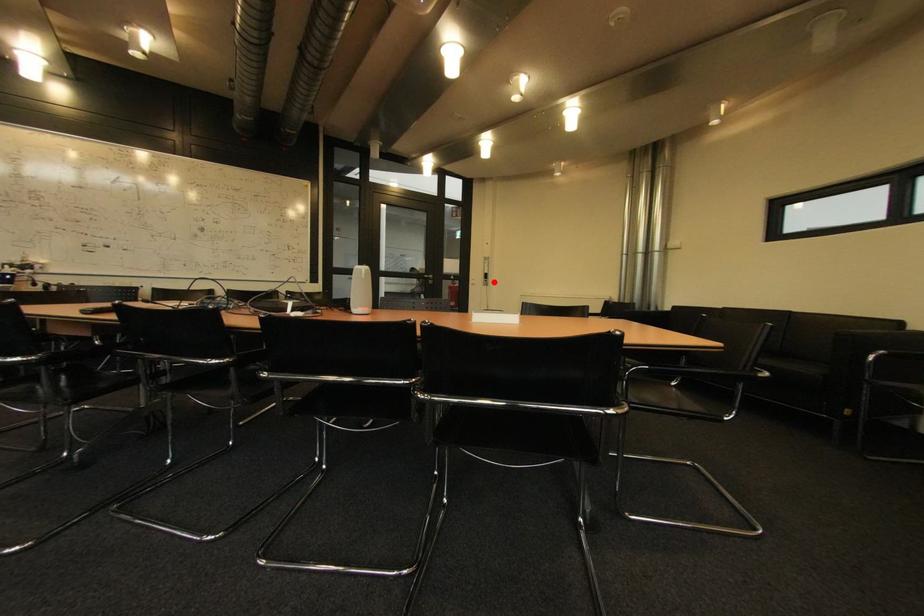
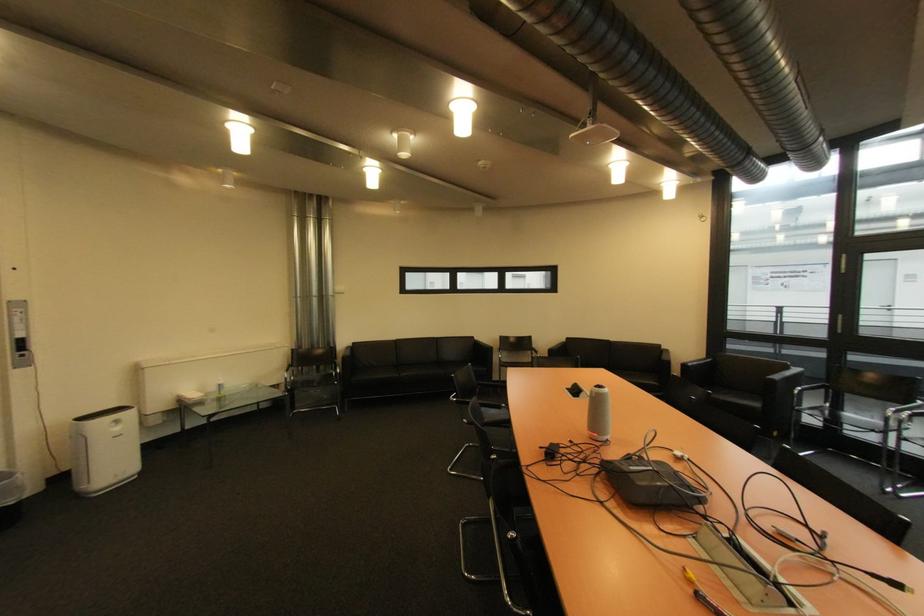
Find the pixel in the second image that matches the highlighted location in the first image.

(30, 357)